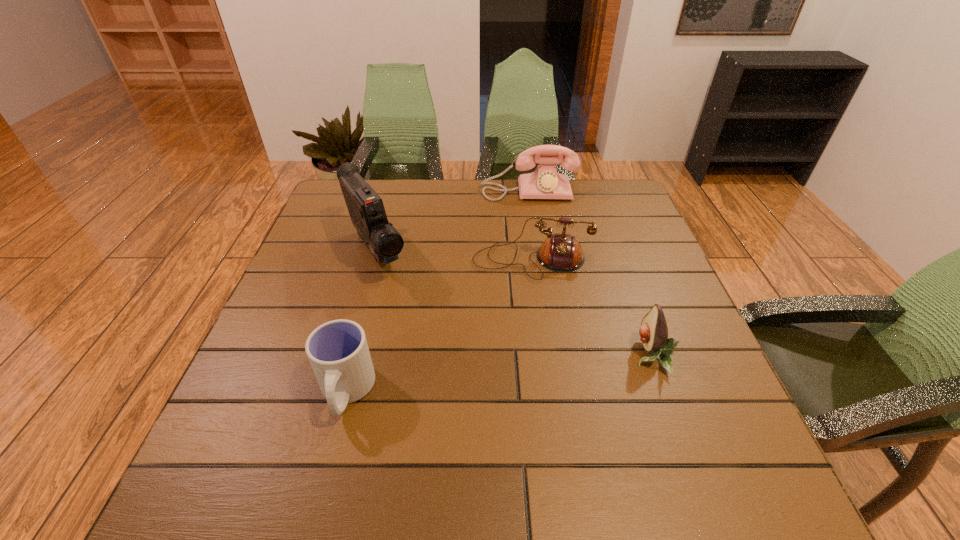
You are a GUI agent. You are given a task and a screenshot of the screen. Output one action in this format:
    pyautogui.click(x=<x>, y=<y>)
    Task: Click on the vacant space located on the dial of the second tallest object
    The height and width of the screenshot is (540, 960).
    Given the screenshot: What is the action you would take?
    pyautogui.click(x=532, y=235)

Find the location of a particular element. The image size is (960, 540). blank area located on the dial of the second tallest object is located at coordinates [532, 235].

Identify the location of blank space located 0.370m on the front-facing side of the camcorder. (464, 396).

The height and width of the screenshot is (540, 960). I want to click on vacant area located 0.120m on the front-facing side of the camcorder, so click(410, 315).

Find the location of a particular element. This screenshot has height=540, width=960. free space located on the front-facing side of the camcorder is located at coordinates (456, 384).

Where is `vacant space located on the rotary dial of the shorter telephone`? vacant space located on the rotary dial of the shorter telephone is located at coordinates (522, 305).

In order to click on free region located on the rotary dial of the shorter telephone in this screenshot , I will do `click(510, 401)`.

Find the location of `free space located on the rotary dial of the shorter telephone`. free space located on the rotary dial of the shorter telephone is located at coordinates (512, 379).

You are a GUI agent. You are given a task and a screenshot of the screen. Output one action in this format:
    pyautogui.click(x=<x>, y=<y>)
    Task: Click on the telephone situated at the far edge
    This screenshot has height=540, width=960.
    Given the screenshot: What is the action you would take?
    pyautogui.click(x=545, y=182)

Locate an element on the screen. This screenshot has width=960, height=540. camcorder located in the far edge section of the desktop is located at coordinates [366, 209].